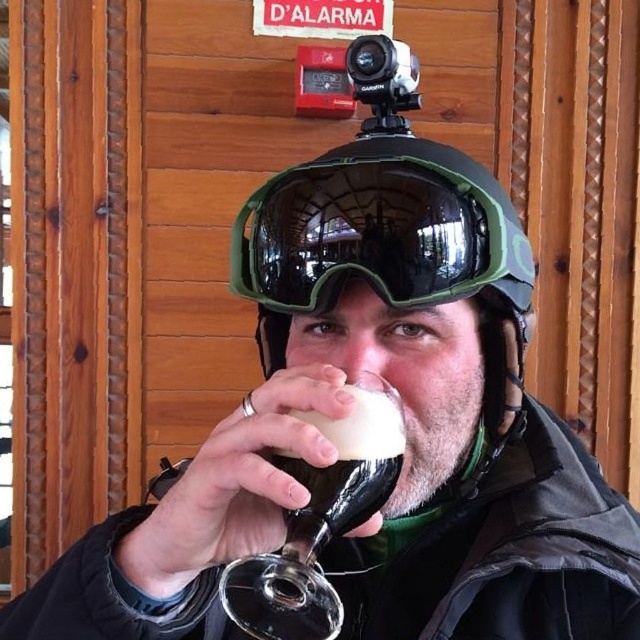
Is point (291, 192) farther from viewer compared to point (394, 291)?

Yes.

Which is behind, point (394, 88) or point (467, 208)?

Positioned behind is point (394, 88).

Find the location of a particular element. This screenshot has height=640, width=640. green matte helmet at center is located at coordinates (392, 241).

You are a GUI agent. You are given a task and a screenshot of the screen. Output one action in this format:
    pyautogui.click(x=<x>, y=<y>)
    Task: Click on the green matte helmet at center
    This screenshot has width=640, height=640.
    Given the screenshot: What is the action you would take?
    pyautogui.click(x=392, y=241)

Does green matte/glossy goggles at center come in front of translucent glass wine glass at center?

No, it is not.

Which of these two, green matte/glossy goggles at center or translucent glass wine glass at center, stands taller?

translucent glass wine glass at center is taller.

Is point (458, 164) less distant than point (234, 586)?

No.

Locate an element on the screen. The width and height of the screenshot is (640, 640). green matte/glossy goggles at center is located at coordinates (380, 232).

Is green matte helmet at center positioned before translucent glass wine glass at center?

No, green matte helmet at center is further to the viewer.

Can you confirm if green matte helmet at center is taller than translucent glass wine glass at center?

Indeed, green matte helmet at center has a greater height compared to translucent glass wine glass at center.

Is point (387, 234) positioned in front of point (291, 467)?

No.

This screenshot has width=640, height=640. Find the location of `green matte helmet at center`. green matte helmet at center is located at coordinates [392, 241].